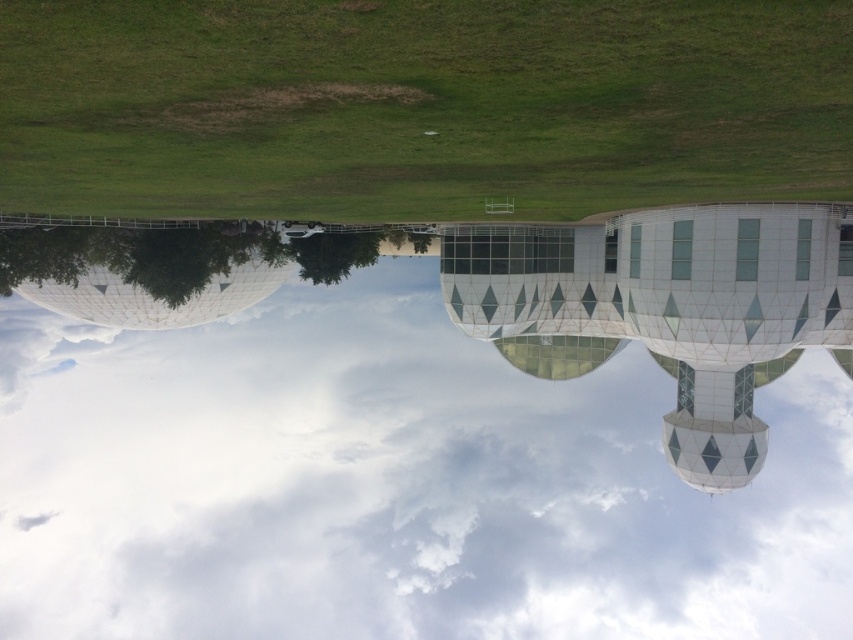
Between white cloud at upper center and green grass at center, which one has more height?

With more height is white cloud at upper center.

Measure the distance between point (399,481) and camera.

154.24 meters

Which is in front, point (787, 580) or point (727, 77)?

Positioned in front is point (727, 77).

Identify the location of white cloud at upper center. point(370,461).